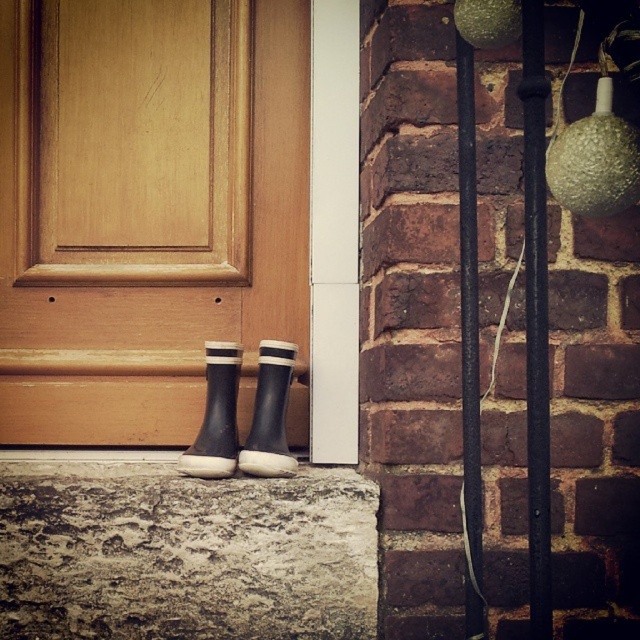
Question: Does black rubber boot at lower center come behind rubber matte boot at center?

Choices:
 (A) no
 (B) yes

Answer: (A)

Question: Which of the following is the closest to the observer?

Choices:
 (A) (180, 92)
 (B) (246, 465)

Answer: (B)

Question: Which of the following is the closest to the observer?

Choices:
 (A) (212, 115)
 (B) (228, 445)
 (C) (248, 445)

Answer: (B)

Question: From the image, what is the correct spatial relationship of matte wood door at lower center in relation to rubber matte boot at center?

Choices:
 (A) left
 (B) right

Answer: (A)

Question: In this image, where is matte wood door at lower center located relative to black rubber boot at lower center?

Choices:
 (A) above
 (B) below

Answer: (A)

Question: Which object is positioned closest to the rubber matte boot at center?

Choices:
 (A) matte wood door at lower center
 (B) black rubber boot at lower center

Answer: (B)